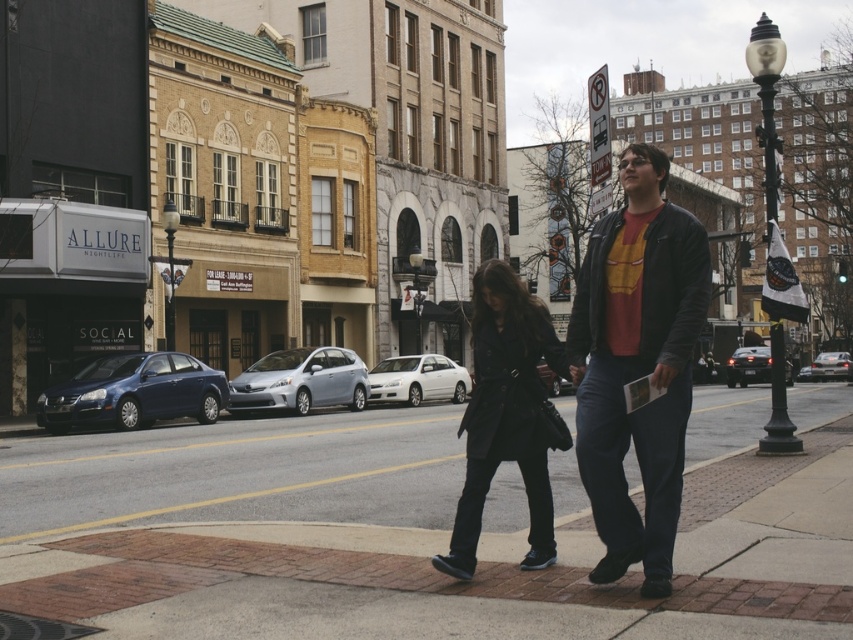
Is matte black jacket at center thinner than silver metallic sedan at center?

Yes, matte black jacket at center is thinner than silver metallic sedan at center.

Can you confirm if matte black jacket at center is positioned above silver metallic sedan at center?

Yes, matte black jacket at center is above silver metallic sedan at center.

This screenshot has width=853, height=640. What do you see at coordinates (637, 364) in the screenshot? I see `matte black jacket at center` at bounding box center [637, 364].

Locate an element on the screen. Image resolution: width=853 pixels, height=640 pixels. matte black jacket at center is located at coordinates (637, 364).

Does matte black coat at center appear on the right side of shiny blue sedan at left?

Correct, you'll find matte black coat at center to the right of shiny blue sedan at left.

Between matte black coat at center and shiny blue sedan at left, which one appears on the left side from the viewer's perspective?

From the viewer's perspective, shiny blue sedan at left appears more on the left side.

Measure the distance between matte black coat at center and camera.

matte black coat at center and camera are 5.28 meters apart.

This screenshot has width=853, height=640. Find the location of `matte black coat at center`. matte black coat at center is located at coordinates (508, 413).

Can you confirm if matte black jacket at center is positioned to the left of shiny black sedan at center?

Correct, you'll find matte black jacket at center to the left of shiny black sedan at center.

Can you confirm if matte black jacket at center is wider than shiny black sedan at center?

In fact, matte black jacket at center might be narrower than shiny black sedan at center.

Describe the element at coordinates (637, 364) in the screenshot. This screenshot has width=853, height=640. I see `matte black jacket at center` at that location.

Find the location of a particular element. The image size is (853, 640). matte black jacket at center is located at coordinates (637, 364).